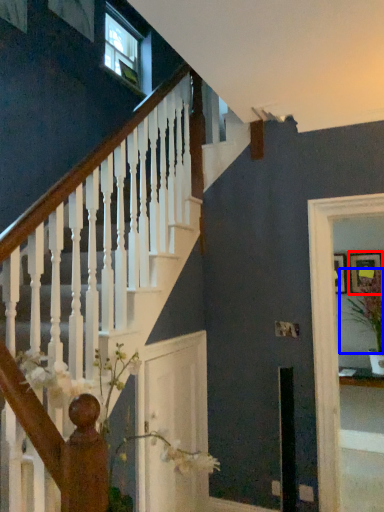
Question: Which object appears farthest to the camera in this image, picture frame (highlighted by a red box) or plant (highlighted by a blue box)?

Choices:
 (A) picture frame
 (B) plant

Answer: (A)